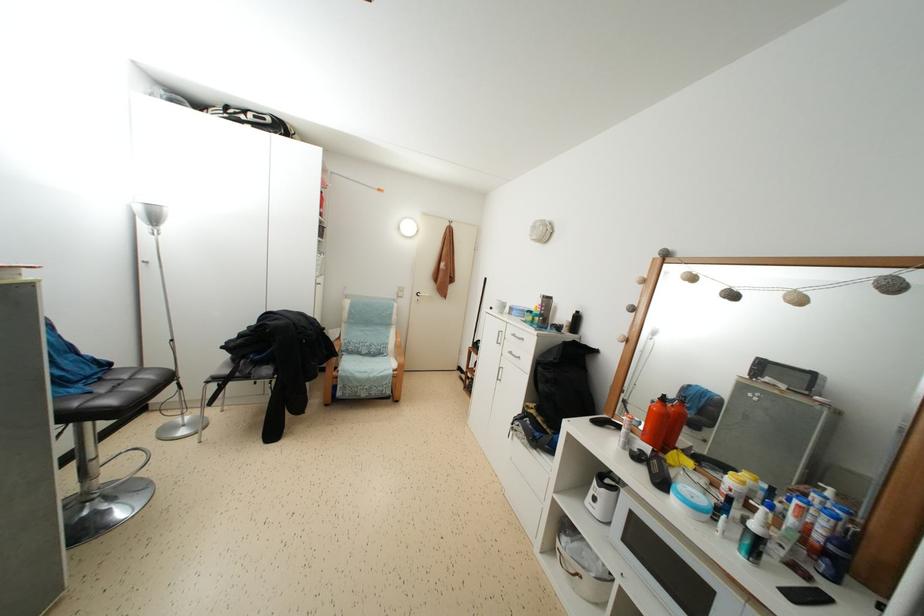
Describe the element at coordinates (581, 564) in the screenshot. I see `a white plastic basket` at that location.